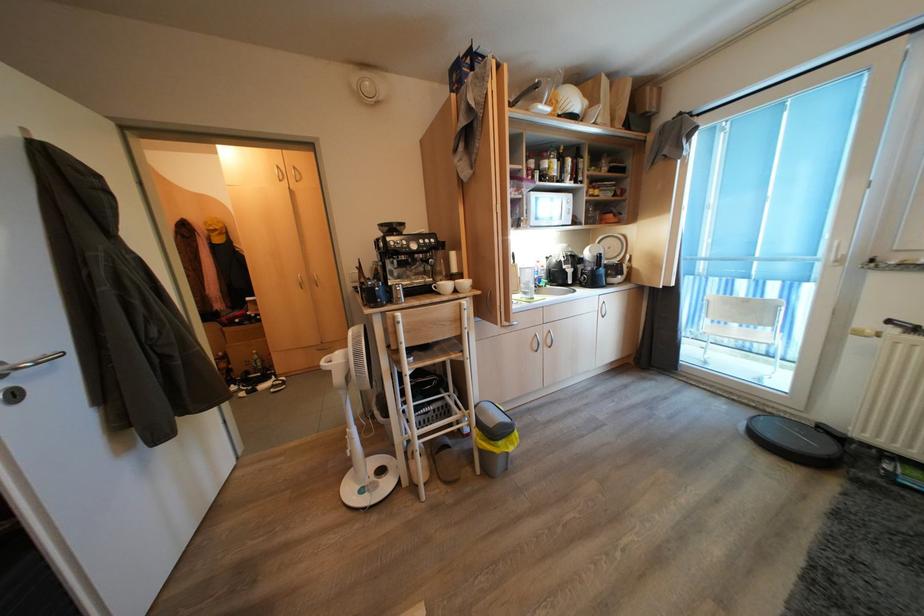
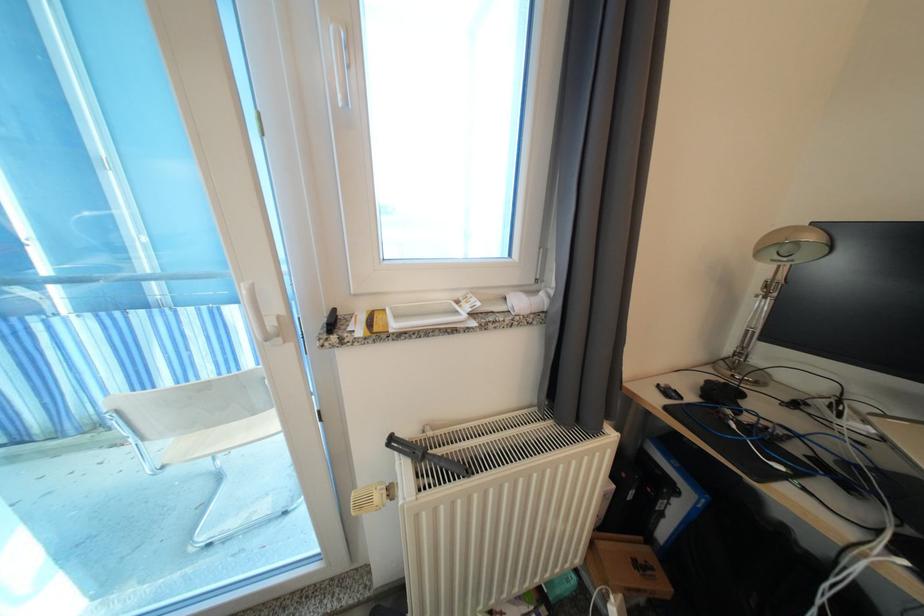
Locate, in the second image, the point that corresponds to point 894,325 in the first image.

(395, 445)